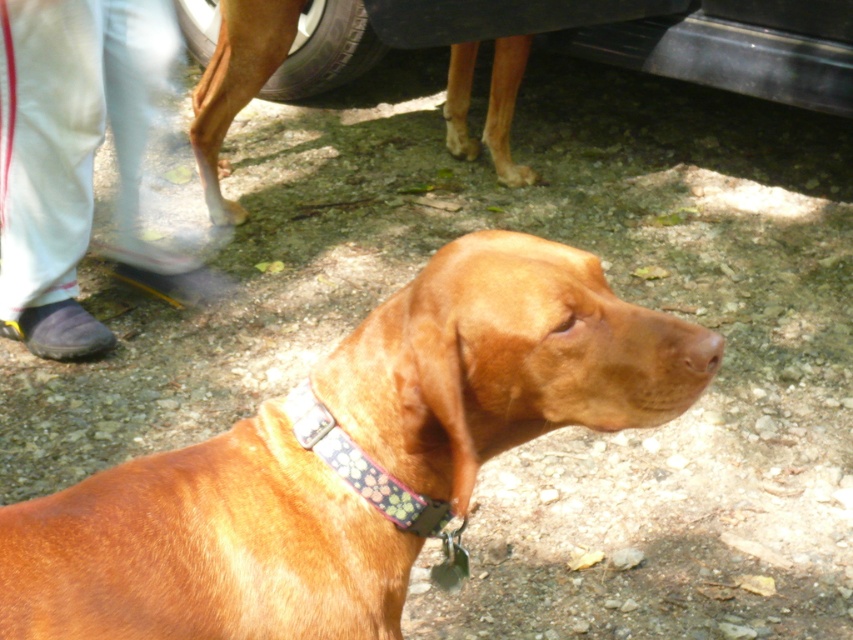
You are a dog trainer assessing the dogs in the image. The brown leather dog at center and the brown matte nose at center are both present. Which object is taller?

The brown leather dog at center is taller than the brown matte nose at center.